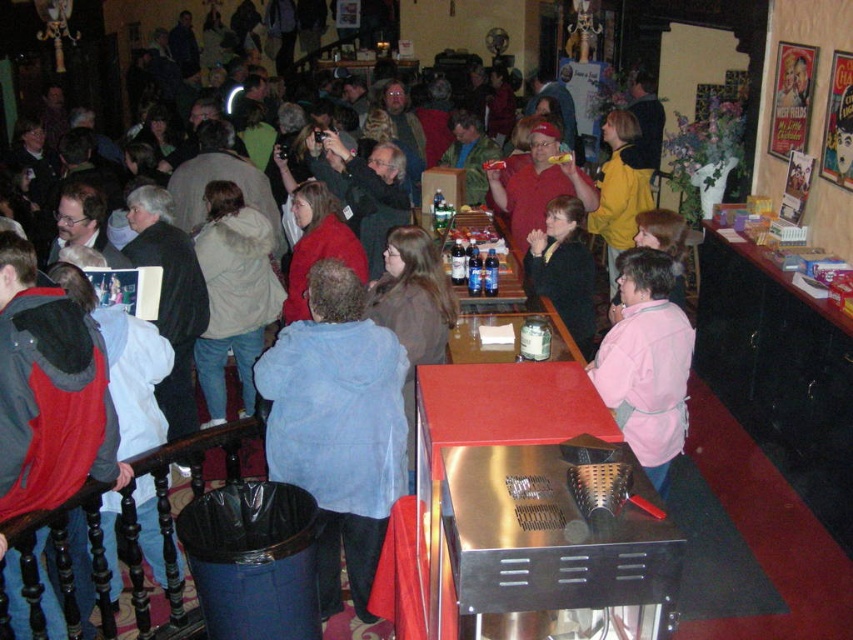
You are standing at the entrance of the bar and want to move towards the two points marked in the scene. Which point, point (648, 458) or point (569, 232), will you reach first?

You will reach point (648, 458) first because it is closer to you than point (569, 232).

You are standing at the entrance of the bar and notice a red jacket at left. Where exactly is the red jacket positioned in relation to the entrance?

The red jacket at left is located at point 0.613 on the horizontal axis and 0.059 on the vertical axis relative to the entrance.

You are a guest at this event and want to hang your coat on the coat rack near the entrance. You have a coat that is 30 cm wide. The red jacket at left and beige fuzzy coat at center are already hanging there. Which coat can you place next to without overlapping?

The red jacket at left has a lesser width compared to beige fuzzy coat at center. Since your coat is 30 cm wide, you can place it next to the red jacket at left as it has less width and there might be sufficient space.